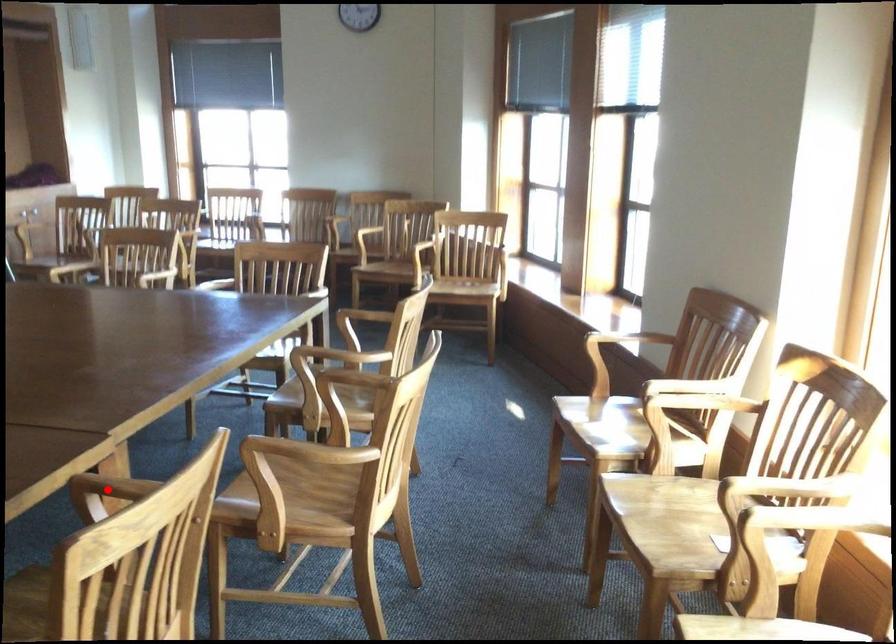
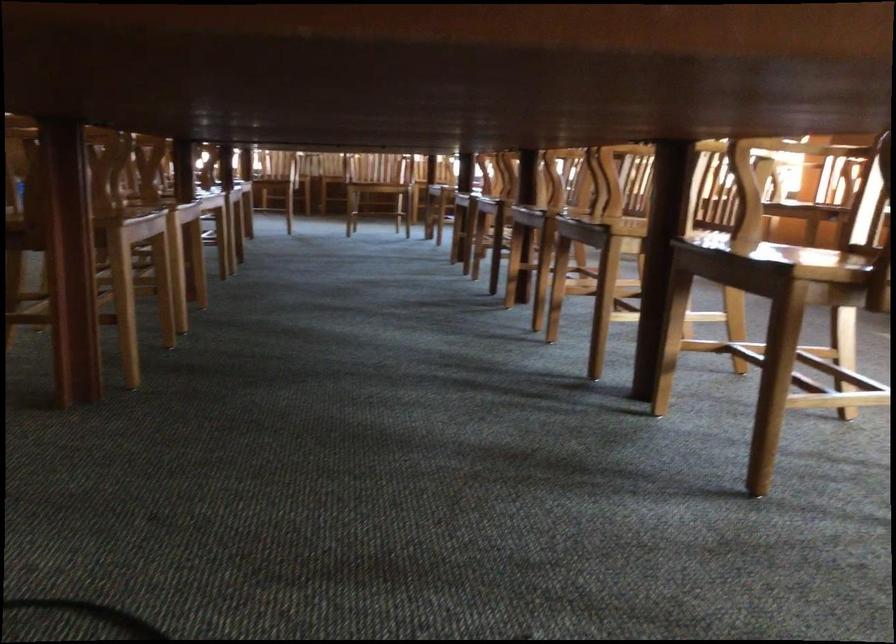
Question: I am providing you with two images of the same scene from different viewpoints. A red point is marked on the first image. At the location where the point appears in image 1, is it still visible in image 2?

Choices:
 (A) Yes
 (B) No

Answer: (B)